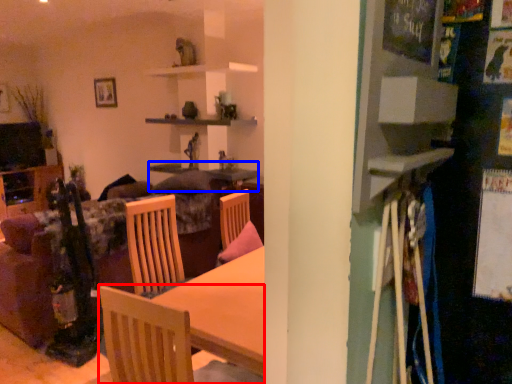
Question: Which point is further to the camera, chair (highlighted by a red box) or table (highlighted by a blue box)?

Choices:
 (A) chair
 (B) table

Answer: (B)